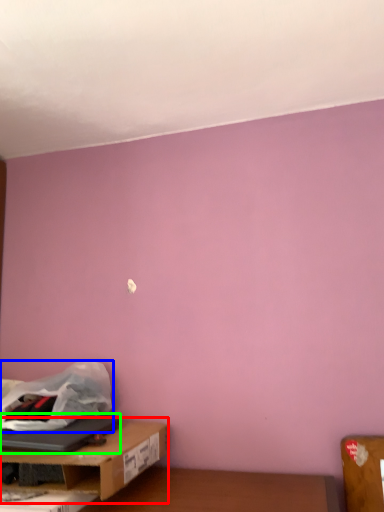
Question: Based on their relative distances, which object is nearer to table (highlighted by a red box)? Choose from plastic bag (highlighted by a blue box) and laptop (highlighted by a green box).

Choices:
 (A) plastic bag
 (B) laptop

Answer: (B)